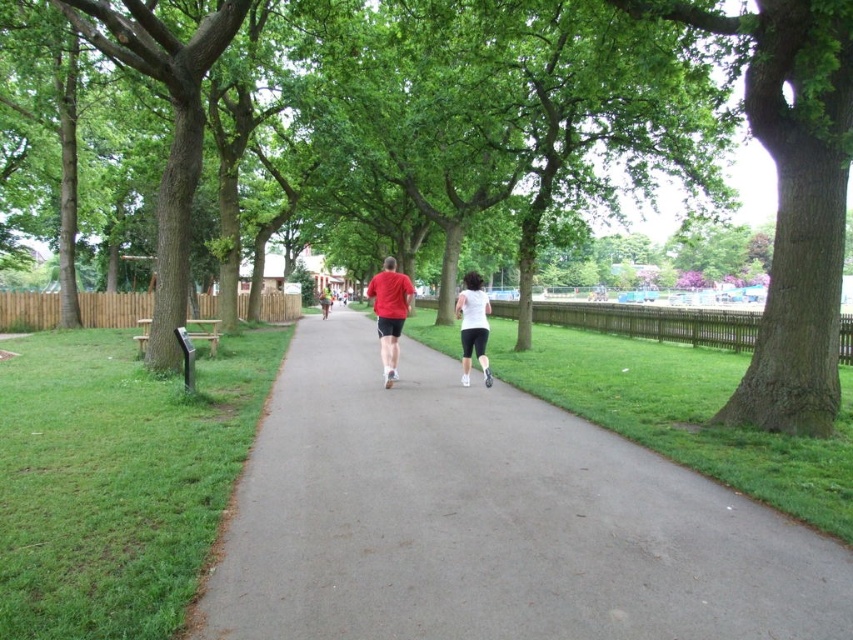
You are standing at the starting point of the park pathway and see two points marked on the path ahead of you. The first point is at coordinate point (418, 573) and the second is at point (328, 132). If you were to walk towards both points, which point would you reach first?

Point (418, 573) is in front of point (328, 132), so you would reach point (418, 573) first.